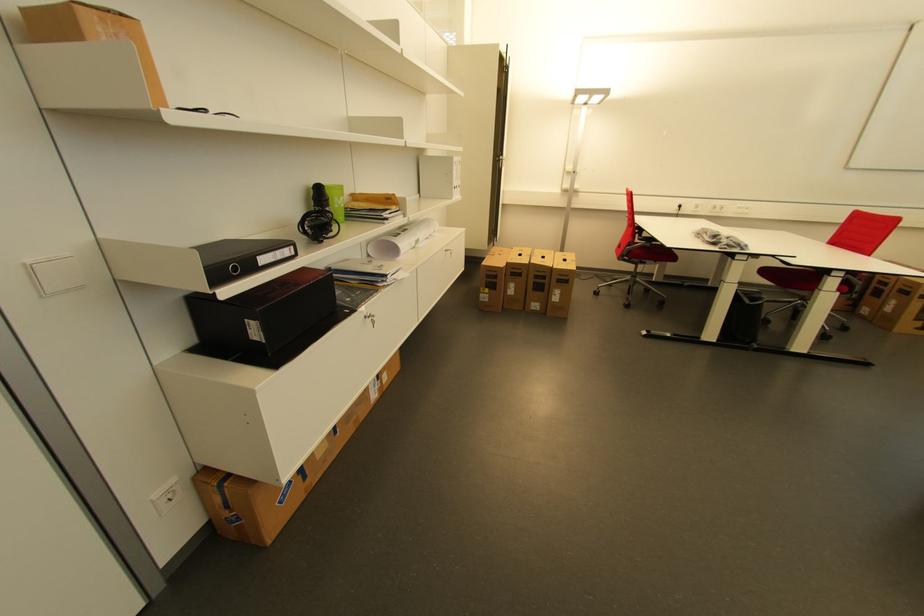
Find where to pull the binder finger hole. Please return your answer as a coordinate pair (x, y).

(245, 262)